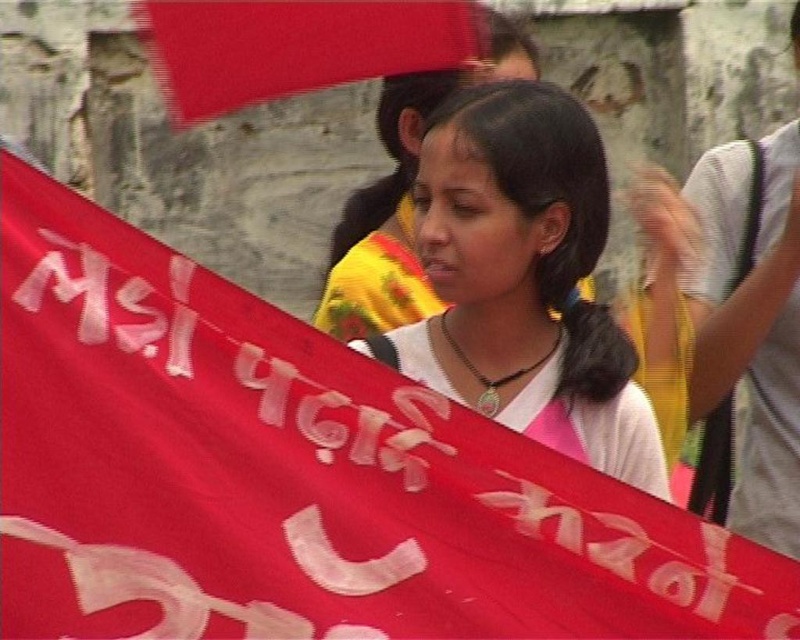
Locate an element on the screen. The height and width of the screenshot is (640, 800). white matte shirt at center is located at coordinates (524, 280).

Is point (518, 84) more distant than point (158, 35)?

No, it is in front of (158, 35).

At what (x,y) coordinates should I click in order to perform the action: click on white matte shirt at center. Please return your answer as a coordinate pair (x, y). The height and width of the screenshot is (640, 800). Looking at the image, I should click on (524, 280).

Image resolution: width=800 pixels, height=640 pixels. I want to click on white matte shirt at center, so click(x=524, y=280).

Where is `matte red flag at upper center`? matte red flag at upper center is located at coordinates (294, 45).

Is point (238, 44) positioned before point (460, 68)?

That is True.

Where is `matte red flag at upper center`? This screenshot has width=800, height=640. matte red flag at upper center is located at coordinates (294, 45).

Is point (502, 225) positioned behind point (440, 300)?

No, it is in front of (440, 300).

Consider the image. Who is more distant from viewer, (505,198) or (480,81)?

Point (480,81)

Where is `white matte shirt at center`? This screenshot has width=800, height=640. white matte shirt at center is located at coordinates (524, 280).